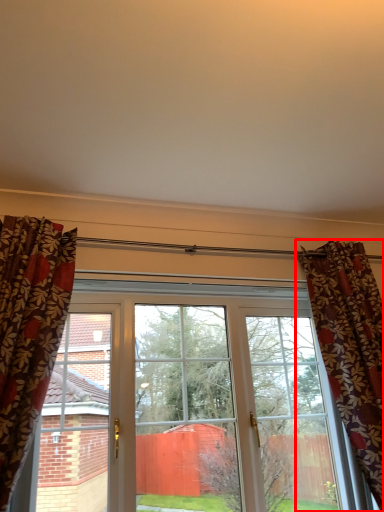
Question: Observing the image, what is the correct spatial positioning of curtain (annotated by the red box) in reference to window?

Choices:
 (A) right
 (B) left

Answer: (A)